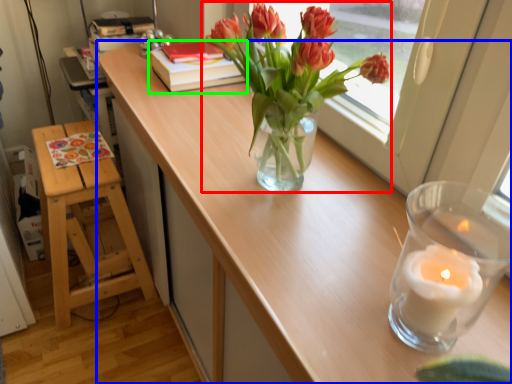
Question: Based on their relative distances, which object is farther from houseplant (highlighted by a red box)? Choose from table (highlighted by a blue box) and book (highlighted by a green box).

Choices:
 (A) table
 (B) book

Answer: (B)